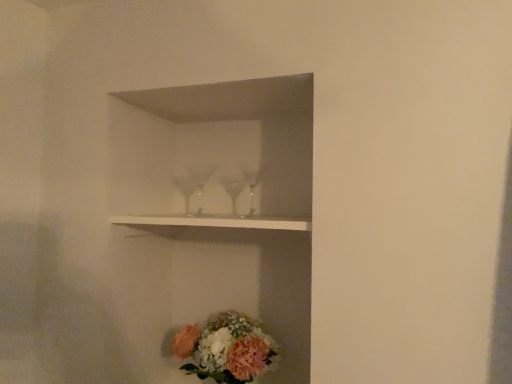
Question: In terms of size, does pastel floral bouquet at lower center appear bigger or smaller than white glossy shelf at upper center?

Choices:
 (A) big
 (B) small

Answer: (A)

Question: From a real-world perspective, relative to white glossy shelf at upper center, is pastel floral bouquet at lower center vertically above or below?

Choices:
 (A) above
 (B) below

Answer: (B)

Question: Is pastel floral bouquet at lower center situated inside white glossy shelf at upper center or outside?

Choices:
 (A) outside
 (B) inside

Answer: (A)

Question: From a real-world perspective, is white glossy shelf at upper center physically located above or below pastel floral bouquet at lower center?

Choices:
 (A) above
 (B) below

Answer: (A)

Question: In the image, is white glossy shelf at upper center positioned in front of or behind pastel floral bouquet at lower center?

Choices:
 (A) front
 (B) behind

Answer: (A)

Question: Is white glossy shelf at upper center wider or thinner than pastel floral bouquet at lower center?

Choices:
 (A) wide
 (B) thin

Answer: (A)

Question: Considering the positions of point (297, 221) and point (250, 342), is point (297, 221) closer or farther from the camera than point (250, 342)?

Choices:
 (A) closer
 (B) farther

Answer: (A)